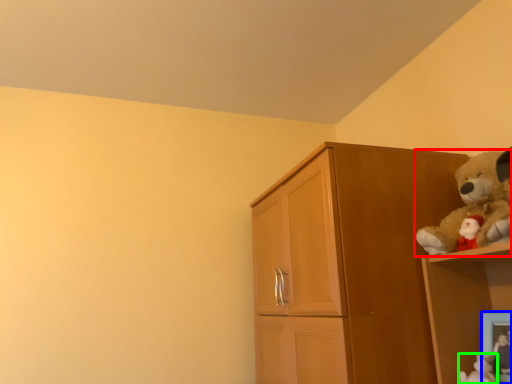
Question: Which object is positioned closest to teddy bear (highlighted by a red box)? Select from picture frame (highlighted by a blue box) and toy (highlighted by a green box).

Choices:
 (A) picture frame
 (B) toy

Answer: (A)